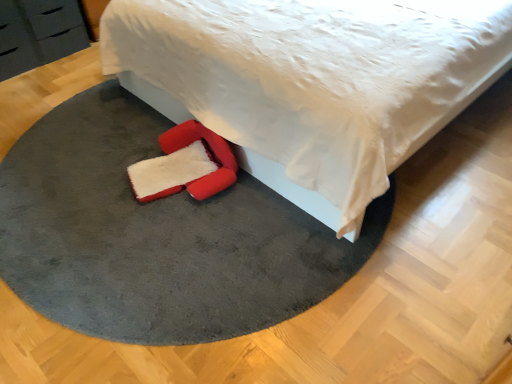
Question: Are black matte drawer at upper left and white soft bed at center making contact?

Choices:
 (A) no
 (B) yes

Answer: (A)

Question: Is white soft bed at center at the back of black matte drawer at upper left?

Choices:
 (A) no
 (B) yes

Answer: (A)

Question: Is the depth of black matte drawer at upper left greater than that of white soft bed at center?

Choices:
 (A) no
 (B) yes

Answer: (B)

Question: Is black matte drawer at upper left closer to the viewer compared to white soft bed at center?

Choices:
 (A) yes
 (B) no

Answer: (B)

Question: Does black matte drawer at upper left have a lesser height compared to white soft bed at center?

Choices:
 (A) no
 (B) yes

Answer: (B)

Question: From the image's perspective, is black matte drawer at upper left located beneath white soft bed at center?

Choices:
 (A) no
 (B) yes

Answer: (B)

Question: Can we say white soft bed at center lies outside black matte drawer at upper left?

Choices:
 (A) no
 (B) yes

Answer: (B)

Question: Does white soft bed at center appear on the right side of black matte drawer at upper left?

Choices:
 (A) yes
 (B) no

Answer: (A)

Question: Is the depth of white soft bed at center less than that of black matte drawer at upper left?

Choices:
 (A) no
 (B) yes

Answer: (B)

Question: From the image's perspective, is white soft bed at center located above black matte drawer at upper left?

Choices:
 (A) no
 (B) yes

Answer: (B)

Question: Can black matte drawer at upper left be found inside white soft bed at center?

Choices:
 (A) yes
 (B) no

Answer: (B)

Question: Does white soft bed at center have a greater width compared to black matte drawer at upper left?

Choices:
 (A) yes
 (B) no

Answer: (A)

Question: Considering the relative sizes of velvet gray rug at center and white soft bed at center in the image provided, is velvet gray rug at center bigger than white soft bed at center?

Choices:
 (A) yes
 (B) no

Answer: (B)